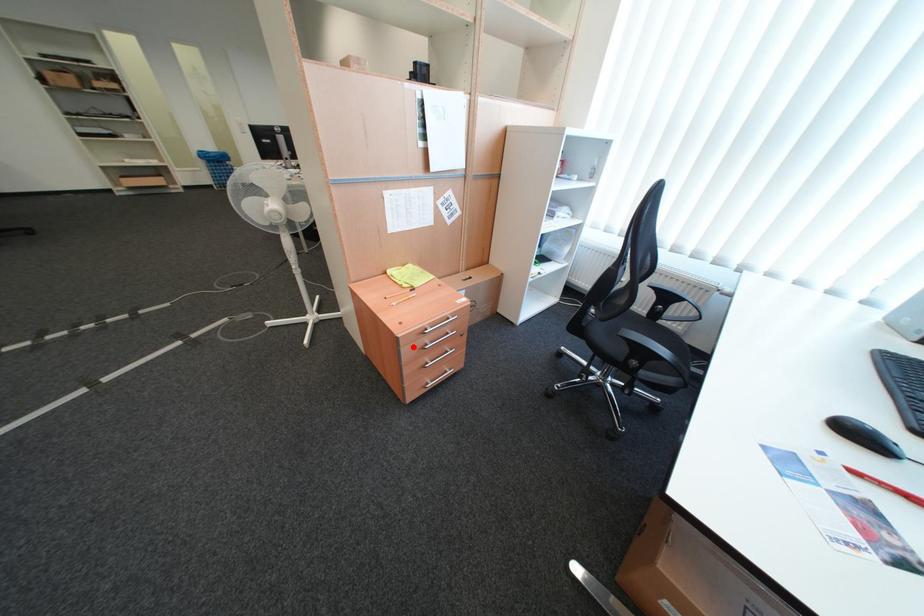
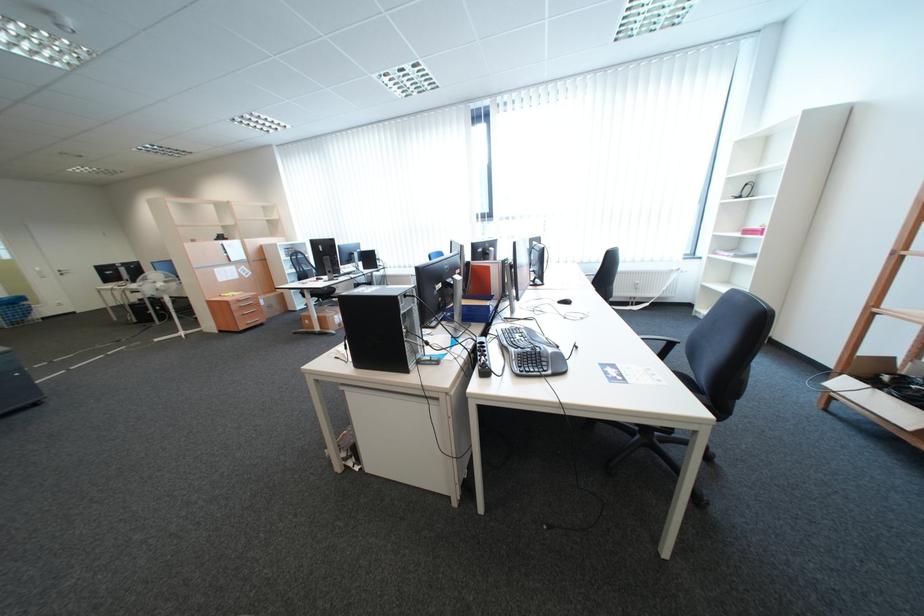
Question: I am providing you with two images of the same scene from different viewpoints. Given a red point in image1, look at the same physical point in image2. Is it:

Choices:
 (A) Closer to the viewpoint
 (B) Farther from the viewpoint

Answer: (A)